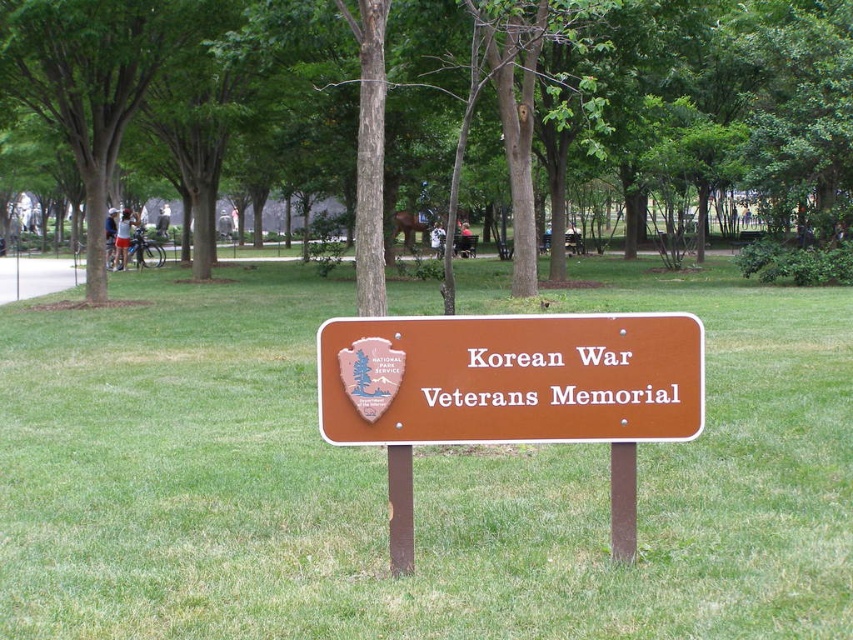
You are standing at the Korean War Veterans Memorial sign in the park. There is a point marked at coordinates [456,97]. Which object in the scene does this point correspond to?

The point at coordinates [456,97] corresponds to the green leafy tree at center.